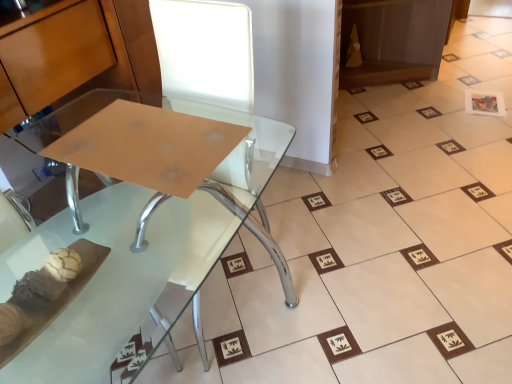
Question: From the image's perspective, is clear glass table at center located above or below white paper at upper right?

Choices:
 (A) above
 (B) below

Answer: (B)

Question: Is clear glass table at center in front of or behind white paper at upper right in the image?

Choices:
 (A) behind
 (B) front

Answer: (B)

Question: In terms of width, does clear glass table at center look wider or thinner when compared to white paper at upper right?

Choices:
 (A) thin
 (B) wide

Answer: (B)

Question: Is white paper at upper right to the left or to the right of clear glass table at center in the image?

Choices:
 (A) left
 (B) right

Answer: (B)

Question: Relative to clear glass table at center, is white paper at upper right in front or behind?

Choices:
 (A) behind
 (B) front

Answer: (A)

Question: Considering the positions of white paper at upper right and clear glass table at center in the image, is white paper at upper right taller or shorter than clear glass table at center?

Choices:
 (A) short
 (B) tall

Answer: (A)

Question: In terms of width, does white paper at upper right look wider or thinner when compared to clear glass table at center?

Choices:
 (A) thin
 (B) wide

Answer: (A)